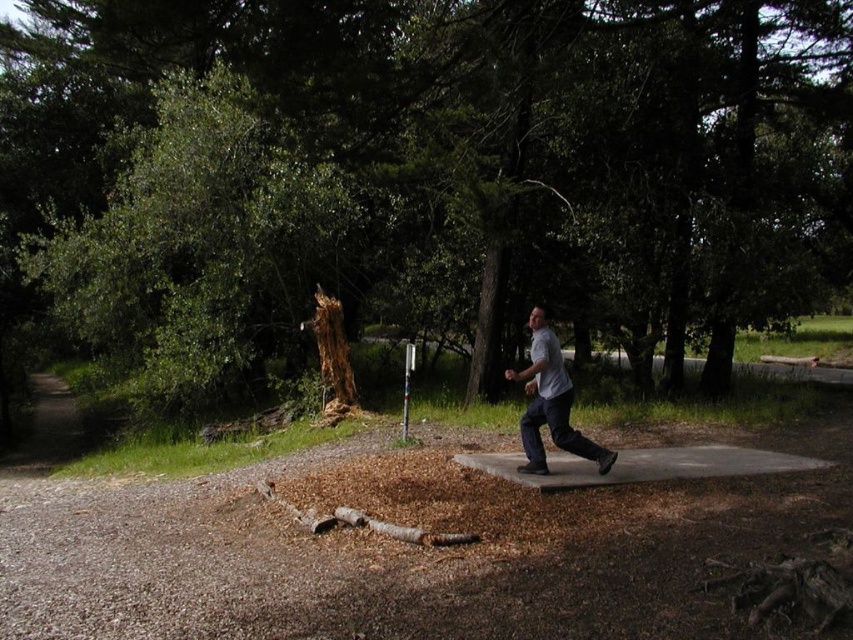
Where is `concrete slab at center`? The width and height of the screenshot is (853, 640). concrete slab at center is located at coordinates (642, 465).

Can you confirm if concrete slab at center is thinner than white cotton shirt at center?

No.

Who is more distant from viewer, (727, 461) or (602, 472)?

Positioned behind is point (727, 461).

At what (x,y) coordinates should I click in order to perform the action: click on concrete slab at center. Please return your answer as a coordinate pair (x, y). This screenshot has height=640, width=853. Looking at the image, I should click on (642, 465).

Is point (517, 92) positioned in front of point (532, 332)?

No, it is not.

Is brown rough tree at center thinner than white cotton shirt at center?

In fact, brown rough tree at center might be wider than white cotton shirt at center.

Locate an element on the screen. The height and width of the screenshot is (640, 853). brown rough tree at center is located at coordinates (549, 138).

Which is more to the left, brown rough tree at center or concrete slab at center?

brown rough tree at center is more to the left.

Can you confirm if brown rough tree at center is taller than concrete slab at center?

Yes.

Between point (641, 150) and point (490, 461), which one is positioned behind?

Positioned behind is point (641, 150).

The height and width of the screenshot is (640, 853). I want to click on brown rough tree at center, so click(549, 138).